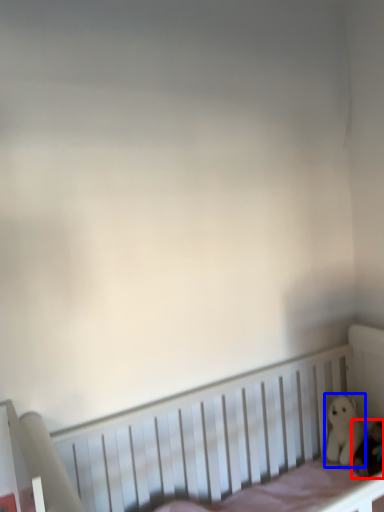
Question: Which of the following is the farthest to the observer, toy (highlighted by a red box) or toy (highlighted by a blue box)?

Choices:
 (A) toy
 (B) toy

Answer: (B)